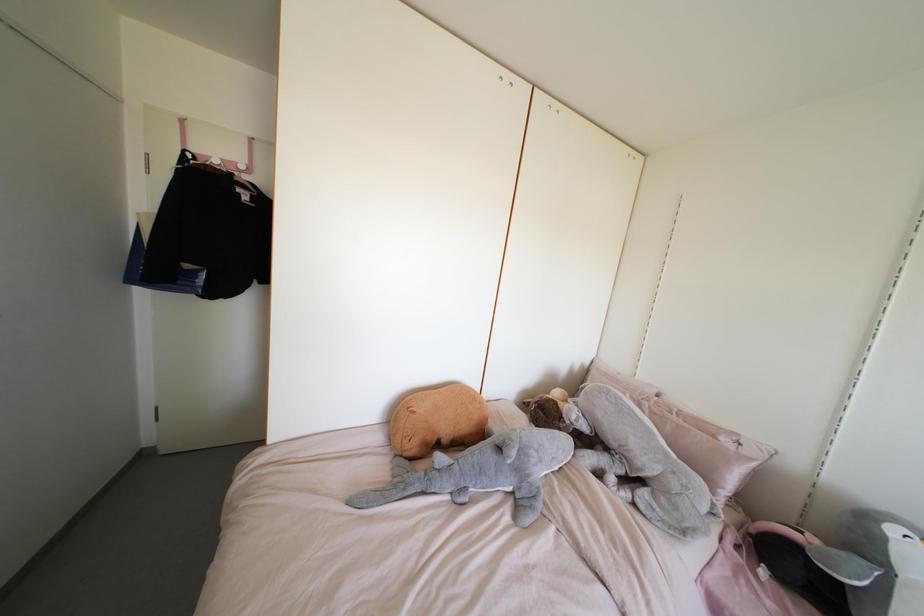
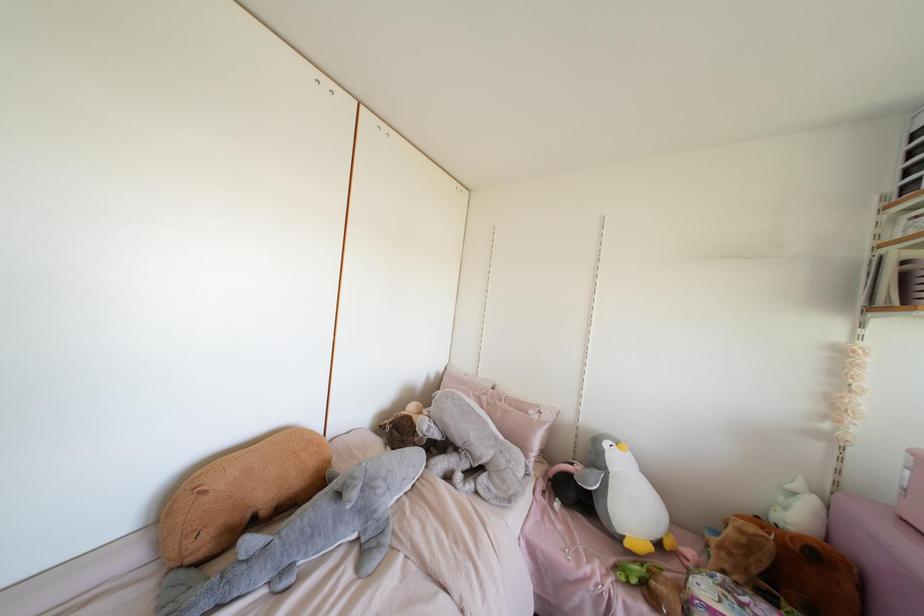
Find the pixel in the second image that matches (553,458) in the first image.

(403, 479)